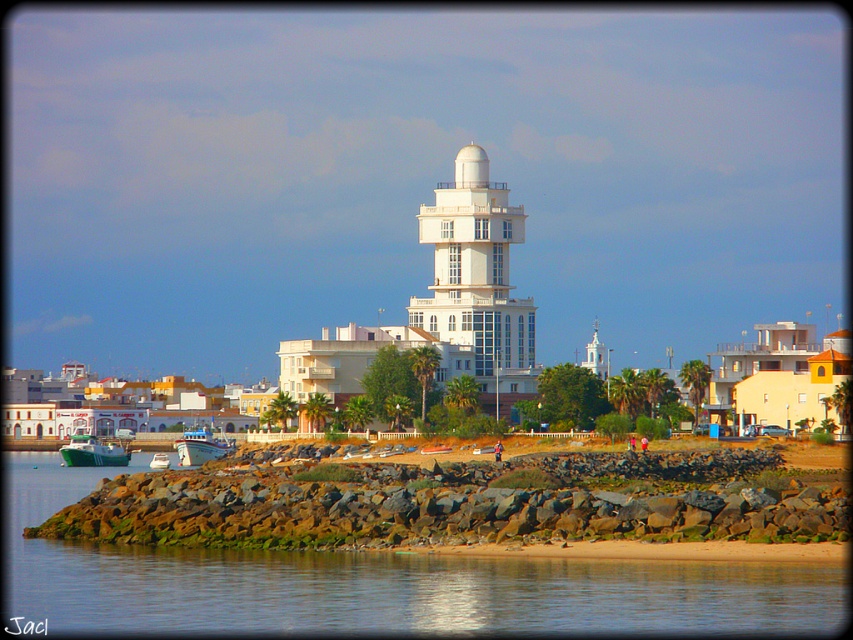
Question: Can you confirm if green stone wall at lower center is positioned to the left of white glossy boat at center?

Choices:
 (A) yes
 (B) no

Answer: (B)

Question: Is green matte boat at lower left wider than white glossy steeple at upper center?

Choices:
 (A) no
 (B) yes

Answer: (B)

Question: Which is nearer to the green stone wall at lower center?

Choices:
 (A) white glossy tower at center
 (B) white glossy steeple at upper center

Answer: (A)

Question: Among these objects, which one is nearest to the camera?

Choices:
 (A) green matte boat at lower left
 (B) white glossy steeple at upper center

Answer: (A)

Question: Which is farther from the white glossy steeple at upper center?

Choices:
 (A) green matte boat at lower left
 (B) white glossy boat at center

Answer: (A)

Question: Can you confirm if white glossy tower at center is smaller than white glossy steeple at upper center?

Choices:
 (A) yes
 (B) no

Answer: (B)